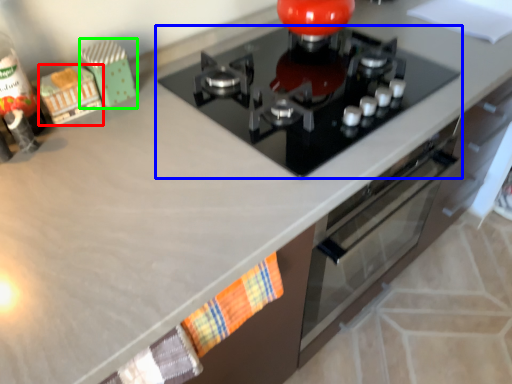
Question: Which is farther away from toy (highlighted by a red box)? gas stove (highlighted by a blue box) or toy (highlighted by a green box)?

Choices:
 (A) gas stove
 (B) toy

Answer: (A)